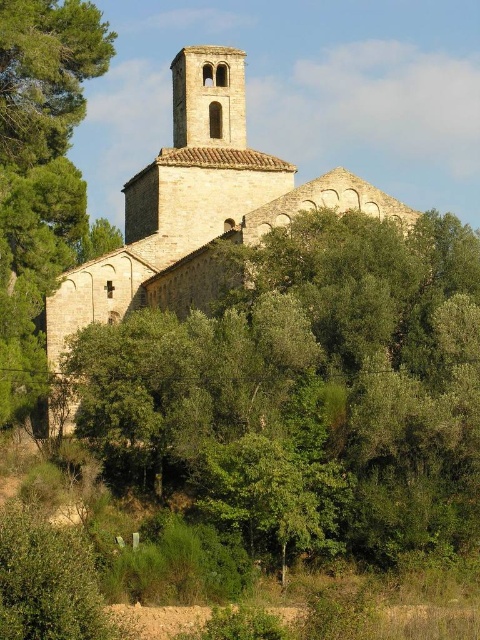
Question: Which of the following is the farthest from the observer?

Choices:
 (A) click(420, 387)
 (B) click(317, 184)
 (C) click(27, 138)

Answer: (C)

Question: Which object is the farthest from the green leafy tree at left?

Choices:
 (A) green leafy tree at center
 (B) stone church at center

Answer: (A)

Question: Which point is farther from the camera taking this photo?

Choices:
 (A) (346, 513)
 (B) (189, 49)

Answer: (B)

Question: Considering the relative positions of green leafy tree at center and green leafy tree at left in the image provided, where is green leafy tree at center located with respect to green leafy tree at left?

Choices:
 (A) right
 (B) left

Answer: (A)

Question: Does green leafy tree at center appear under stone church at center?

Choices:
 (A) no
 (B) yes

Answer: (B)

Question: Is green leafy tree at center wider than stone church at center?

Choices:
 (A) no
 (B) yes

Answer: (A)